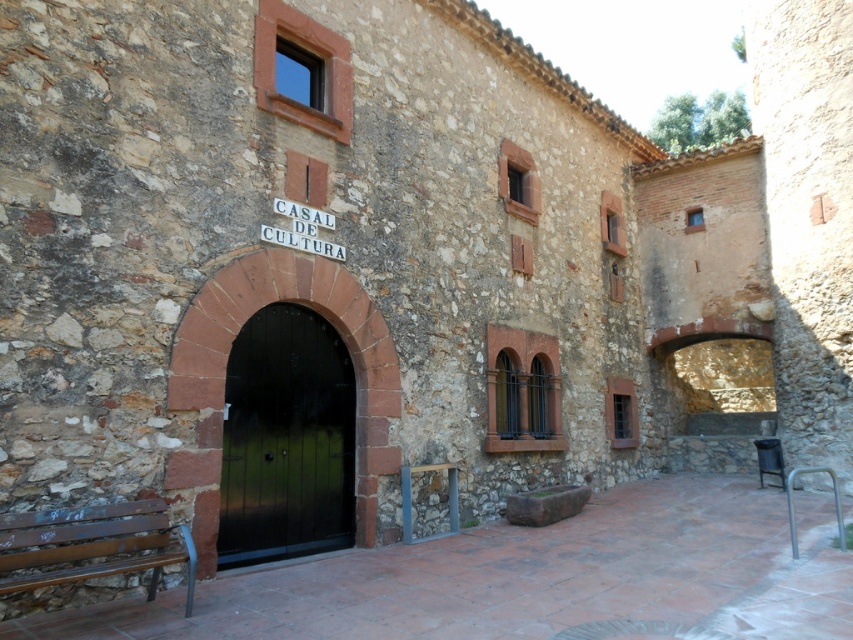
Question: Which object is positioned farthest from the rustic wood bench at lower left?

Choices:
 (A) brown wooden bench at lower left
 (B) black wooden door at center

Answer: (B)

Question: Among these objects, which one is nearest to the camera?

Choices:
 (A) brown wooden bench at lower left
 (B) rustic wood bench at lower left
 (C) black wooden door at center

Answer: (B)

Question: Can you confirm if black wooden door at center is positioned below rustic wood bench at lower left?

Choices:
 (A) yes
 (B) no

Answer: (B)

Question: Does brown wooden bench at lower left have a lesser width compared to rustic wood bench at lower left?

Choices:
 (A) no
 (B) yes

Answer: (A)

Question: Which is farther from the black wooden door at center?

Choices:
 (A) brown wooden bench at lower left
 (B) rustic wood bench at lower left

Answer: (A)

Question: Observing the image, what is the correct spatial positioning of brown wooden bench at lower left in reference to black wooden door at center?

Choices:
 (A) above
 (B) below

Answer: (B)